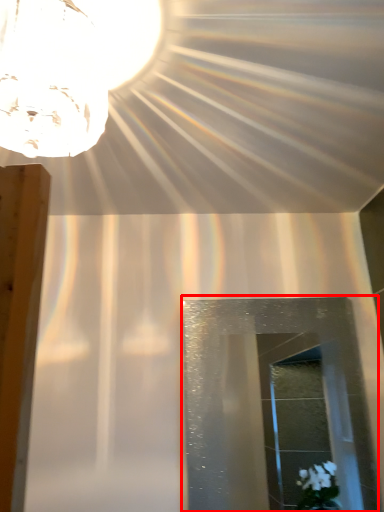
Question: From the image, what is the correct spatial relationship of glass door (annotated by the red box) in relation to lamp?

Choices:
 (A) left
 (B) right

Answer: (B)